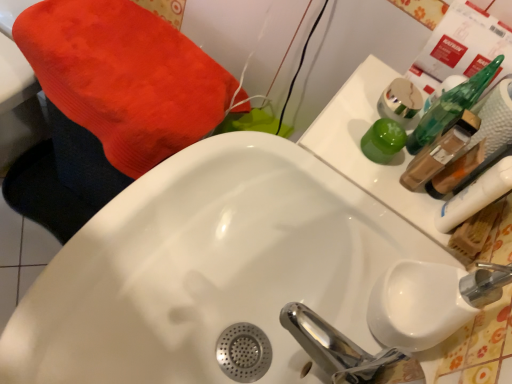
Where is `vacant area to the left of translucent plastic mouthwash at right, which appears as the 1th mouthwash when ordered from the bottom`? The image size is (512, 384). vacant area to the left of translucent plastic mouthwash at right, which appears as the 1th mouthwash when ordered from the bottom is located at coordinates (356, 167).